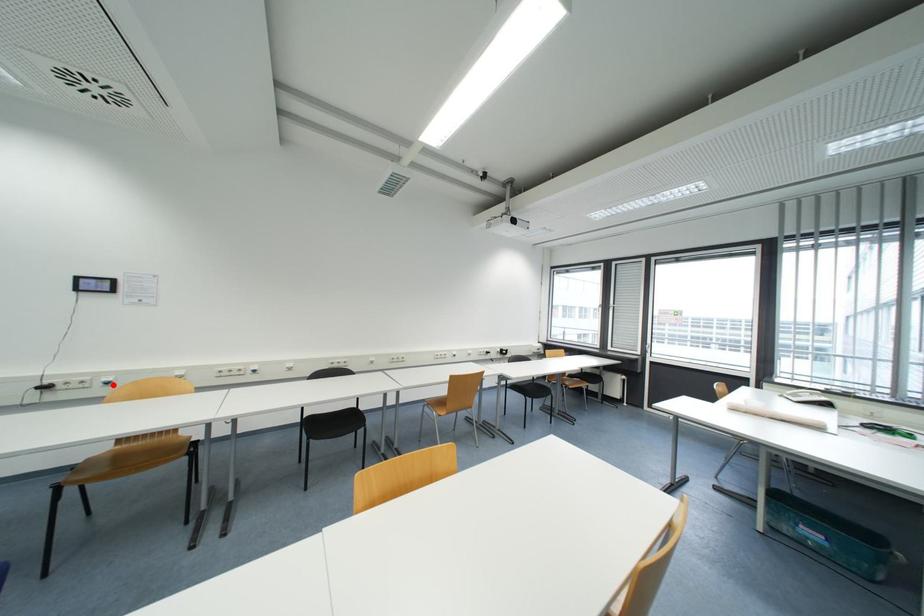
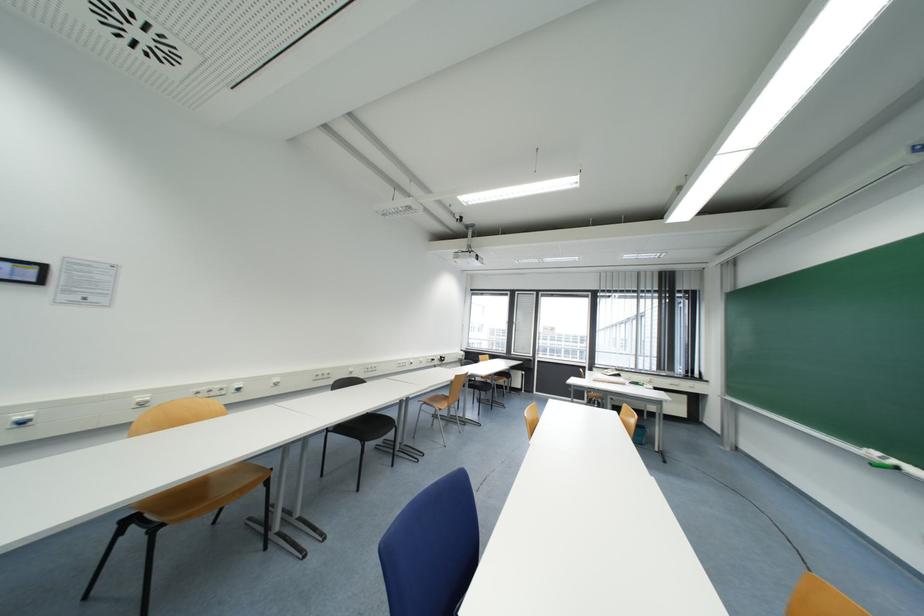
In the second image, find the point that corresponds to the highlighted location in the first image.

(28, 424)